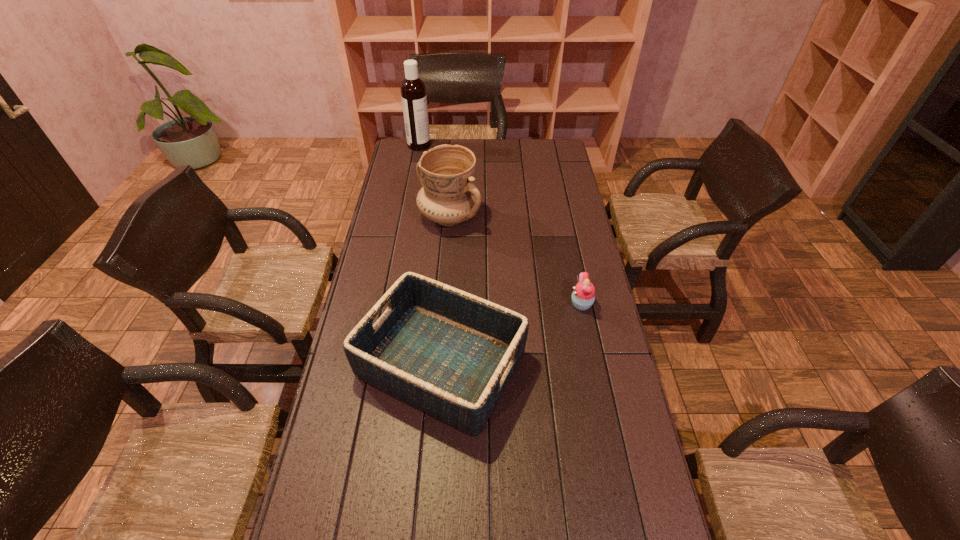
Where is `vacant space located on the face of the shortest object`? vacant space located on the face of the shortest object is located at coordinates (488, 304).

Find the location of a particular element. vacant space located on the face of the shortest object is located at coordinates (521, 304).

Image resolution: width=960 pixels, height=540 pixels. Identify the location of free spot located 0.330m on the face of the shortest object. (469, 304).

Where is `object situated at the far edge`? This screenshot has height=540, width=960. object situated at the far edge is located at coordinates (413, 90).

At what (x,y) coordinates should I click in order to perform the action: click on dishwasher detergent that is positioned at the left edge. Please return your answer as a coordinate pair (x, y). Looking at the image, I should click on (413, 90).

Locate an element on the screen. pottery positioned at the left edge is located at coordinates (449, 197).

I want to click on basket that is at the left edge, so click(451, 354).

At what (x,y) coordinates should I click in order to perform the action: click on object at the right edge. Please return your answer as a coordinate pair (x, y). This screenshot has width=960, height=540. Looking at the image, I should click on (583, 296).

The width and height of the screenshot is (960, 540). What are the coordinates of `object at the far left corner` in the screenshot? It's located at (x=413, y=90).

Locate an element on the screen. The height and width of the screenshot is (540, 960). blank space at the left edge of the desktop is located at coordinates (365, 477).